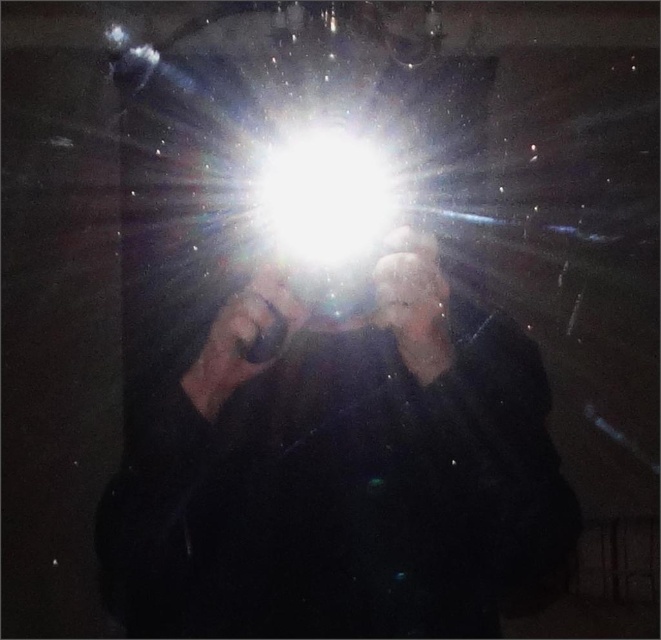
From the picture: Does black matte flashlight at center appear under white glossy light at center?

Yes.

Can you confirm if black matte flashlight at center is thinner than white glossy light at center?

No, black matte flashlight at center is not thinner than white glossy light at center.

Which is in front, point (280, 349) or point (336, 225)?

Point (280, 349) is in front.

In order to click on black matte flashlight at center in this screenshot , I will do `click(338, 468)`.